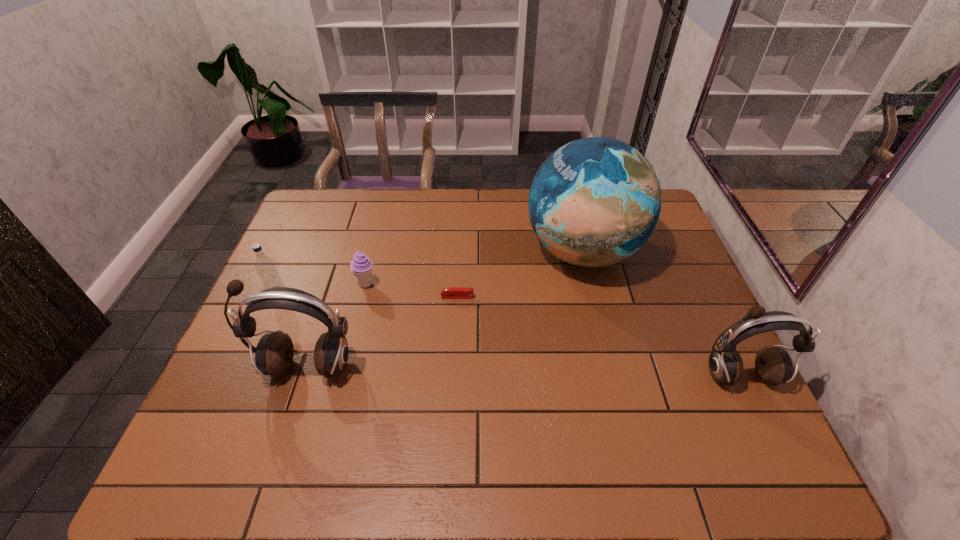
The width and height of the screenshot is (960, 540). Identify the location of vacant space located on the ear pads of the left earphone. (291, 415).

Find the location of a particular element. Image resolution: width=960 pixels, height=540 pixels. vacant space located on the ear pads of the rightmost object is located at coordinates (756, 414).

What are the coordinates of `vacant region located on the front of the tallest object` in the screenshot? It's located at (621, 410).

Locate an element on the screen. vacant region located on the right of the icecream is located at coordinates (493, 285).

Locate an element on the screen. This screenshot has height=540, width=960. free space located 0.200m on the right of the third shortest object is located at coordinates (357, 295).

At what (x,y) coordinates should I click in order to perform the action: click on free point located 0.130m on the front-facing side of the third object from right to left. Please return your answer as a coordinate pair (x, y). This screenshot has width=960, height=540. Looking at the image, I should click on (519, 297).

Image resolution: width=960 pixels, height=540 pixels. Identify the location of object that is at the far edge. (595, 201).

The height and width of the screenshot is (540, 960). In order to click on object positioned at the near edge in this screenshot , I will do `click(774, 366)`.

Where is `earphone positioned at the left edge`? earphone positioned at the left edge is located at coordinates (274, 353).

This screenshot has width=960, height=540. In order to click on water bottle located at the left edge in this screenshot , I will do `click(265, 266)`.